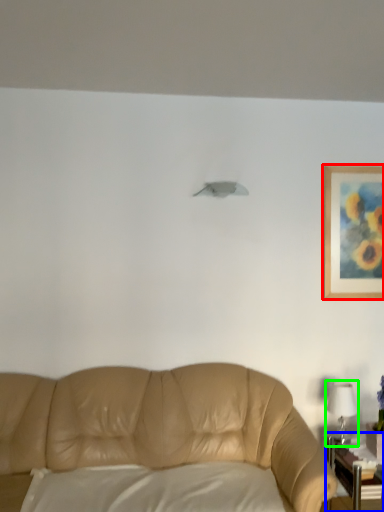
Question: Considering the real-world distances, which object is farthest from picture frame (highlighted by a red box)? table (highlighted by a blue box) or table lamp (highlighted by a green box)?

Choices:
 (A) table
 (B) table lamp

Answer: (A)